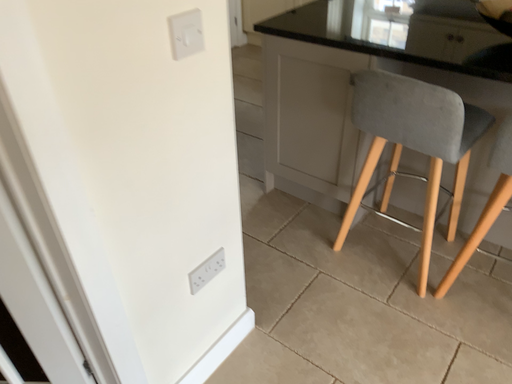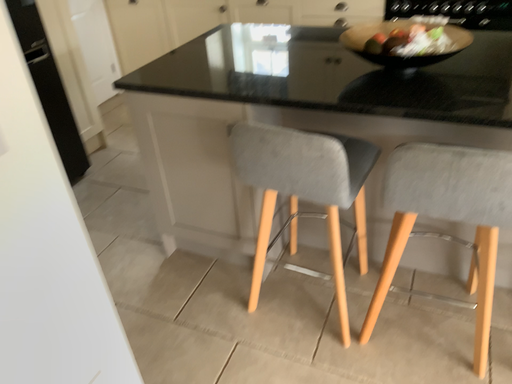
Question: Which way did the camera rotate in the video?

Choices:
 (A) rotated right
 (B) rotated left

Answer: (A)